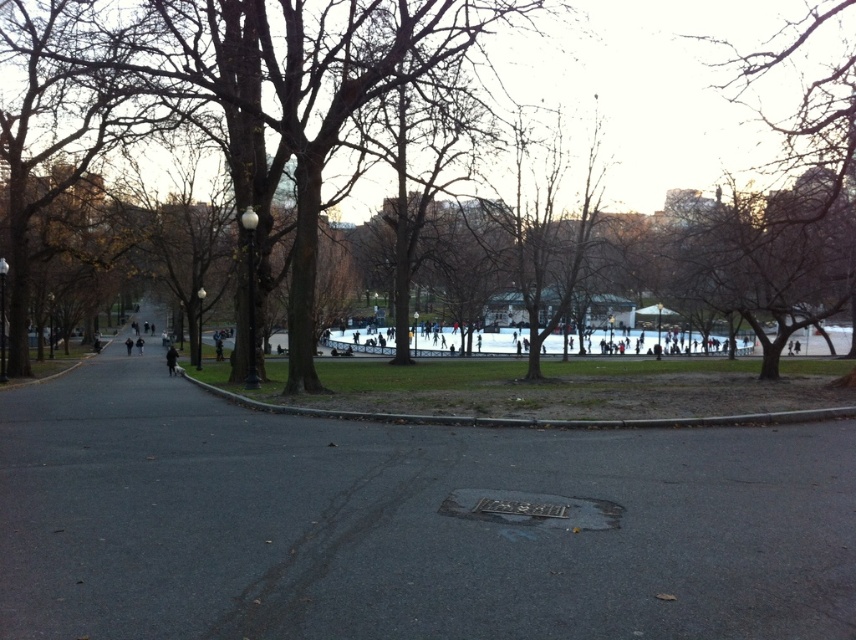
Consider the image. You are a pedestrian walking on the dark asphalt pavement at center. You see a black coat at center. Which one is wider?

The dark asphalt pavement at center is wider than black coat at center.